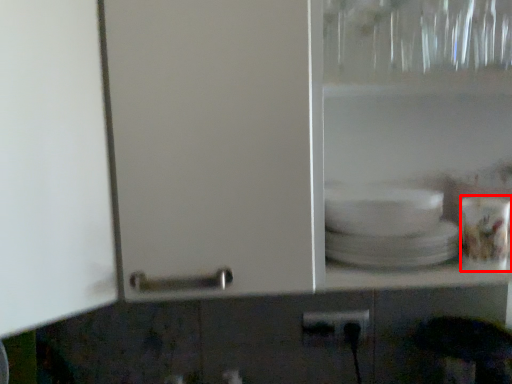
Question: Considering the relative positions of tableware (annotated by the red box) and power plugs and sockets in the image provided, where is tableware (annotated by the red box) located with respect to the staircase?

Choices:
 (A) right
 (B) left

Answer: (A)